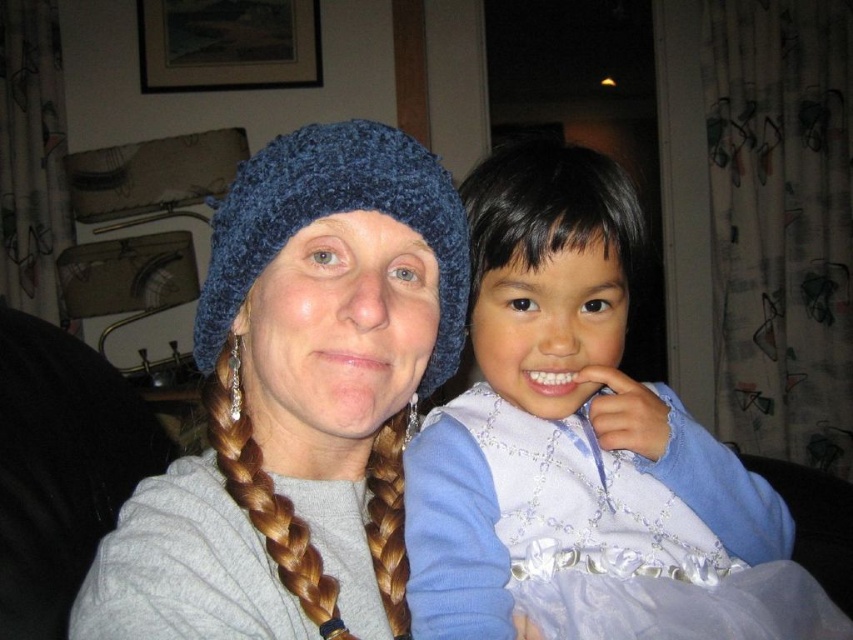
Can you confirm if blue knitted hat at upper left is positioned above blue knitted beanie at center?

No.

Between point (440, 332) and point (308, 172), which one is positioned in front?

Positioned in front is point (308, 172).

What are the coordinates of `blue knitted hat at upper left` in the screenshot? It's located at (297, 397).

Does blue knitted beanie at center appear under brown braided hair at left?

No, blue knitted beanie at center is not below brown braided hair at left.

Does blue knitted beanie at center have a larger size compared to brown braided hair at left?

Yes, blue knitted beanie at center is bigger than brown braided hair at left.

Between point (387, 125) and point (303, 540), which one is positioned behind?

The point (387, 125) is more distant.

You are a GUI agent. You are given a task and a screenshot of the screen. Output one action in this format:
    pyautogui.click(x=<x>, y=<y>)
    Task: Click on the blue knitted beanie at center
    The height and width of the screenshot is (640, 853).
    Given the screenshot: What is the action you would take?
    pyautogui.click(x=332, y=212)

Who is positioned more to the left, blue knitted hat at upper left or light blue satin dress at right?

blue knitted hat at upper left is more to the left.

How much distance is there between blue knitted hat at upper left and light blue satin dress at right?

The distance of blue knitted hat at upper left from light blue satin dress at right is 5.55 inches.

What do you see at coordinates (297, 397) in the screenshot? I see `blue knitted hat at upper left` at bounding box center [297, 397].

Identify the location of blue knitted hat at upper left. The height and width of the screenshot is (640, 853). (297, 397).